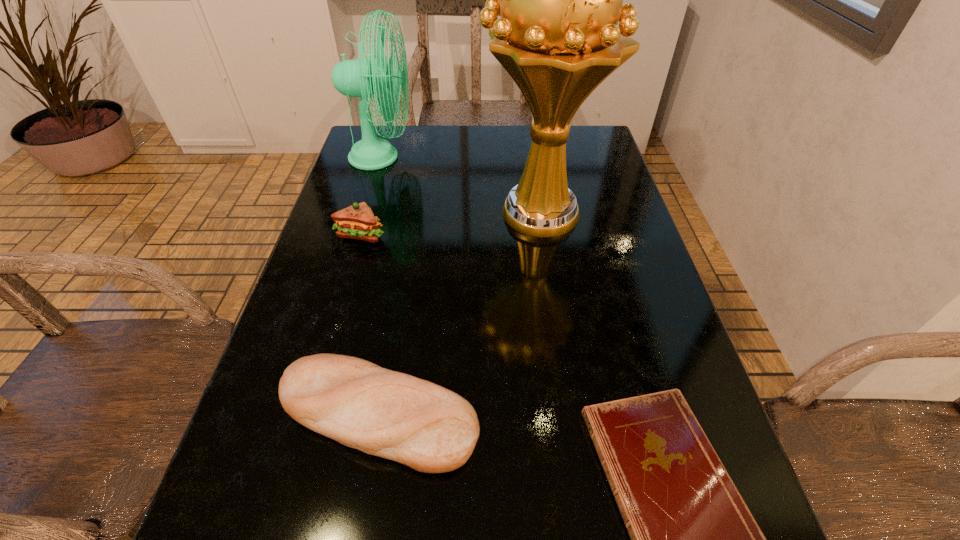
Identify the location of vacant region between the tallest object and the bread. This screenshot has height=540, width=960. (457, 314).

What are the coordinates of `free point between the bread and the third shortest object` in the screenshot? It's located at (369, 325).

The image size is (960, 540). I want to click on free point between the fan and the third shortest object, so click(x=372, y=195).

I want to click on free area in between the bread and the fourth shortest object, so click(x=379, y=286).

Locate an element on the screen. The image size is (960, 540). unoccupied area between the bread and the sandwich is located at coordinates (369, 325).

Locate an element on the screen. free space that is in between the third shortest object and the second tallest object is located at coordinates pos(372,195).

This screenshot has height=540, width=960. Identify the location of object that ranks as the second closest to the fan. (560, 0).

I want to click on the fourth closest object relative to the sandwich, so click(693, 539).

At what (x,y) coordinates should I click in order to perform the action: click on blank area in the image that satisfies the following two spatial constraints: 1. in front of the bread to blow air; 2. on the right side of the fan. Please return your answer as a coordinate pair (x, y). This screenshot has width=960, height=540. Looking at the image, I should click on (305, 415).

Locate an element on the screen. The width and height of the screenshot is (960, 540). vacant area in the image that satisfies the following two spatial constraints: 1. in front of the second tallest object to blow air; 2. on the back side of the third tallest object is located at coordinates (358, 234).